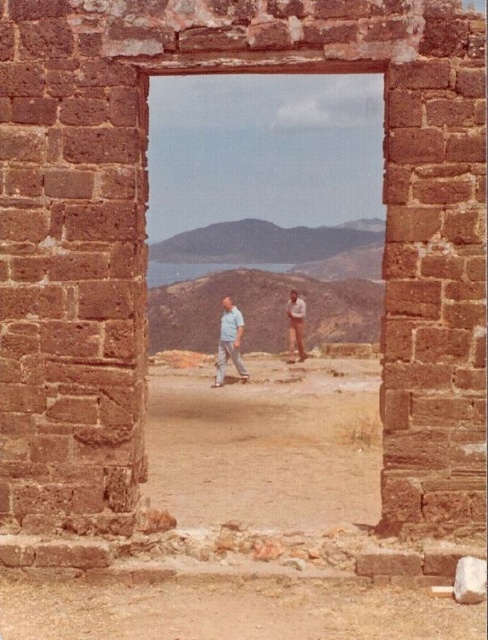
Who is taller, transparent glass window at center or brown sandy dirt at center?

With more height is transparent glass window at center.

Is transparent glass window at center taller than brown sandy dirt at center?

Yes, transparent glass window at center is taller than brown sandy dirt at center.

Does point (232, 109) come closer to viewer compared to point (275, 438)?

That is False.

This screenshot has height=640, width=488. Identify the location of transparent glass window at center. (264, 208).

The width and height of the screenshot is (488, 640). Describe the element at coordinates (265, 445) in the screenshot. I see `brown sandy dirt at center` at that location.

Is the position of brown sandy dirt at center more distant than that of brown sandy dirt at lower center?

Yes, brown sandy dirt at center is further from the viewer.

Is point (302, 388) farther from viewer compared to point (161, 582)?

That is True.

What are the coordinates of `brown sandy dirt at center` in the screenshot? It's located at (265, 445).

Who is positioned more to the left, brown sandy dirt at lower center or light blue denim pants at center?

light blue denim pants at center

Is brown sandy dirt at lower center to the right of light blue denim pants at center from the viewer's perspective?

Indeed, brown sandy dirt at lower center is positioned on the right side of light blue denim pants at center.

At what (x,y) coordinates should I click in order to perform the action: click on brown sandy dirt at lower center. Please return your answer as a coordinate pair (x, y). This screenshot has height=640, width=488. Looking at the image, I should click on (228, 611).

The width and height of the screenshot is (488, 640). I want to click on brown sandy dirt at lower center, so click(x=228, y=611).